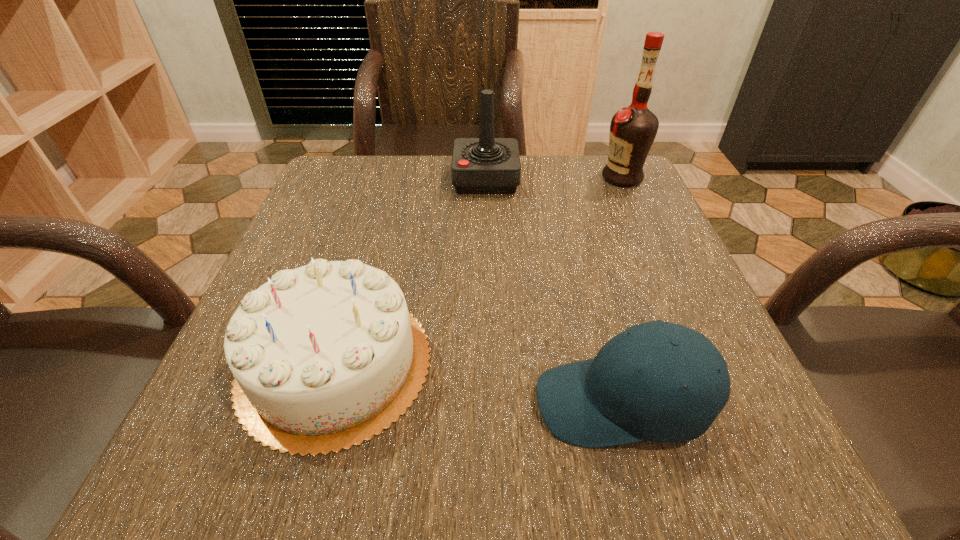
Image resolution: width=960 pixels, height=540 pixels. Identify the location of the tallest object. (633, 129).

The height and width of the screenshot is (540, 960). Find the location of `joystick`. joystick is located at coordinates (486, 165).

Identify the location of birthday cake. (325, 356).

Where is `the third tallest object`? Image resolution: width=960 pixels, height=540 pixels. the third tallest object is located at coordinates (325, 356).

Identify the location of baseball cap. The width and height of the screenshot is (960, 540). (605, 401).

Image resolution: width=960 pixels, height=540 pixels. What are the coordinates of `blank space located 0.270m on the front and back of the tallest object` in the screenshot? It's located at (488, 177).

Where is `vacant space located on the front and back of the tallest object`? The image size is (960, 540). vacant space located on the front and back of the tallest object is located at coordinates (567, 177).

At what (x,y) coordinates should I click in order to perform the action: click on free location located on the front and back of the tallest object. Please return your answer as a coordinate pair (x, y). The width and height of the screenshot is (960, 540). Looking at the image, I should click on click(x=504, y=177).

Locate an element on the screen. This screenshot has height=540, width=960. vacant space situated on the front-facing side of the joystick is located at coordinates (352, 179).

The height and width of the screenshot is (540, 960). In order to click on free point located 0.110m on the front-facing side of the joystick in this screenshot , I will do `click(407, 179)`.